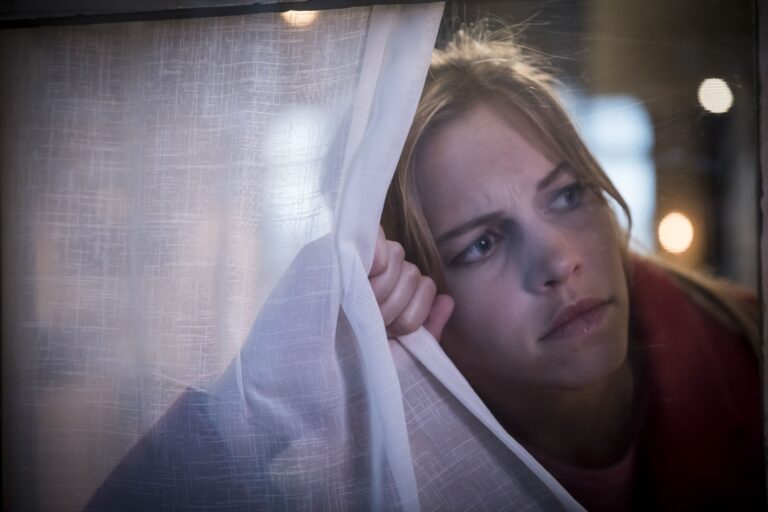
Image resolution: width=768 pixels, height=512 pixels. Identify the location of window. (633, 121), (637, 181), (300, 138).